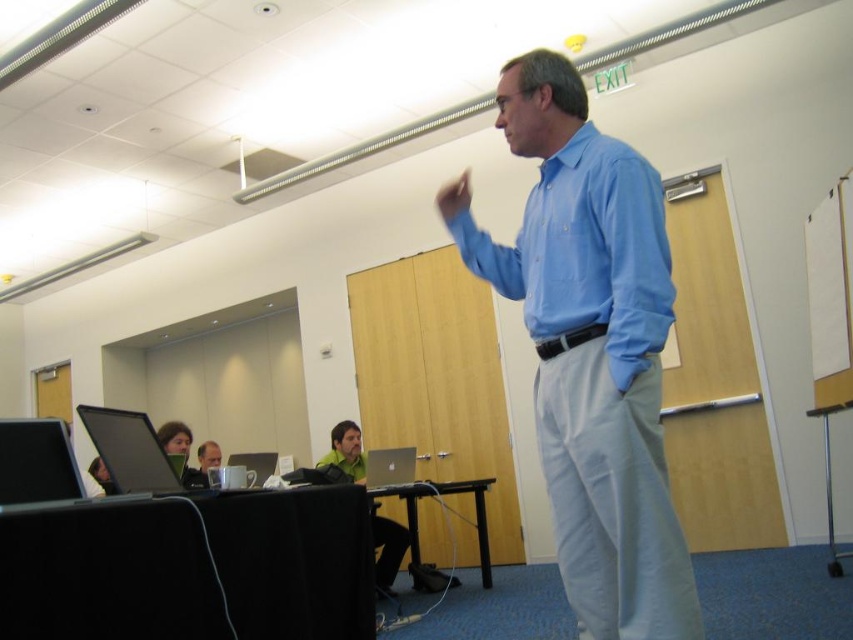
Based on the photo, can you confirm if black glossy laptop at left is thinner than matte silver laptop at center?

Correct, black glossy laptop at left's width is less than matte silver laptop at center's.

Between black glossy laptop at left and matte silver laptop at center, which one has more height?

matte silver laptop at center is taller.

Image resolution: width=853 pixels, height=640 pixels. What are the coordinates of `black glossy laptop at left` in the screenshot? It's located at (36, 461).

Measure the distance between blue cotton shirt at center and black glossy laptop at left.

The distance of blue cotton shirt at center from black glossy laptop at left is 4.57 feet.

Can you confirm if blue cotton shirt at center is wider than black glossy laptop at left?

Indeed, blue cotton shirt at center has a greater width compared to black glossy laptop at left.

Which is behind, point (585, 324) or point (22, 420)?

The point (585, 324) is behind.

Find the location of a particular element. The width and height of the screenshot is (853, 640). blue cotton shirt at center is located at coordinates (590, 349).

In the scene shown: Does blue cotton shirt at center appear under blue smooth shirt at center?

Yes, blue cotton shirt at center is below blue smooth shirt at center.

Does blue cotton shirt at center appear on the left side of blue smooth shirt at center?

In fact, blue cotton shirt at center is to the right of blue smooth shirt at center.

Is point (634, 266) more distant than point (578, 237)?

No, (634, 266) is in front of (578, 237).

The width and height of the screenshot is (853, 640). I want to click on blue cotton shirt at center, so click(x=590, y=349).